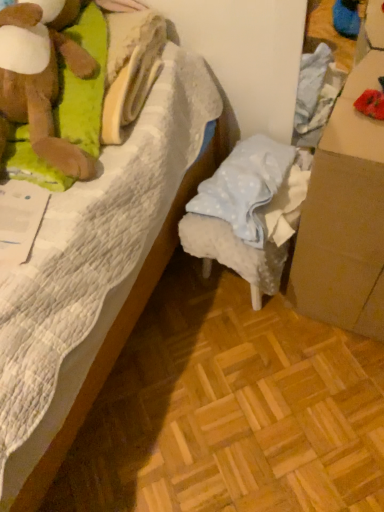
Question: From a real-world perspective, is brown cardboard box at right positioned over white quilted bed at center based on gravity?

Choices:
 (A) yes
 (B) no

Answer: (B)

Question: Can you confirm if brown cardboard box at right is wider than white quilted bed at center?

Choices:
 (A) no
 (B) yes

Answer: (A)

Question: Is brown cardboard box at right to the right of white quilted bed at center from the viewer's perspective?

Choices:
 (A) no
 (B) yes

Answer: (B)

Question: Is the depth of brown cardboard box at right greater than that of white quilted bed at center?

Choices:
 (A) yes
 (B) no

Answer: (A)

Question: Is brown cardboard box at right oriented towards white quilted bed at center?

Choices:
 (A) no
 (B) yes

Answer: (A)

Question: Can you confirm if brown cardboard box at right is taller than white quilted bed at center?

Choices:
 (A) no
 (B) yes

Answer: (A)

Question: From the image's perspective, would you say white quilted bed at center is shown under light blue fabric stool at center?

Choices:
 (A) yes
 (B) no

Answer: (A)

Question: From a real-world perspective, is white quilted bed at center located higher than light blue fabric stool at center?

Choices:
 (A) no
 (B) yes

Answer: (B)

Question: Does white quilted bed at center have a lesser height compared to light blue fabric stool at center?

Choices:
 (A) yes
 (B) no

Answer: (B)

Question: Considering the relative sizes of white quilted bed at center and light blue fabric stool at center in the image provided, is white quilted bed at center bigger than light blue fabric stool at center?

Choices:
 (A) no
 (B) yes

Answer: (B)

Question: Is white quilted bed at center to the right of light blue fabric stool at center from the viewer's perspective?

Choices:
 (A) yes
 (B) no

Answer: (B)

Question: Is white quilted bed at center taller than light blue fabric stool at center?

Choices:
 (A) yes
 (B) no

Answer: (A)

Question: Does brown cardboard box at right contain light blue fabric stool at center?

Choices:
 (A) no
 (B) yes

Answer: (A)